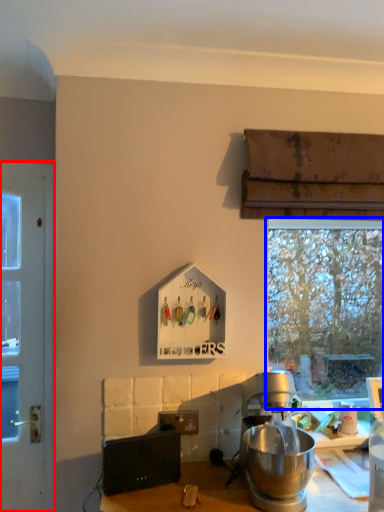
Question: Which point is closer to the camera, door (highlighted by a red box) or window (highlighted by a blue box)?

Choices:
 (A) door
 (B) window

Answer: (A)